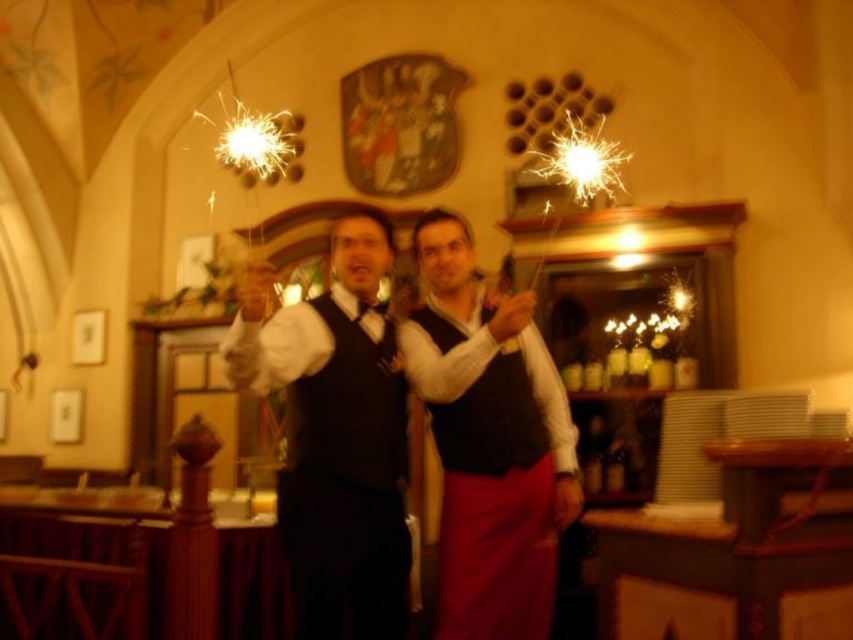
Question: Which object is positioned closest to the matte black vests at center?

Choices:
 (A) black velvet vest at center
 (B) matte black vest at center

Answer: (B)

Question: Is matte black vests at center smaller than black velvet vest at center?

Choices:
 (A) yes
 (B) no

Answer: (B)

Question: Can you confirm if matte black vest at center is smaller than black velvet vest at center?

Choices:
 (A) yes
 (B) no

Answer: (B)

Question: Can you confirm if matte black vest at center is thinner than black velvet vest at center?

Choices:
 (A) yes
 (B) no

Answer: (A)

Question: Which point is farther to the camera?

Choices:
 (A) matte black vest at center
 (B) matte black vests at center
 (C) black velvet vest at center

Answer: (C)

Question: Which point appears closest to the camera in this image?

Choices:
 (A) (383, 417)
 (B) (355, 460)
 (C) (480, 452)

Answer: (B)